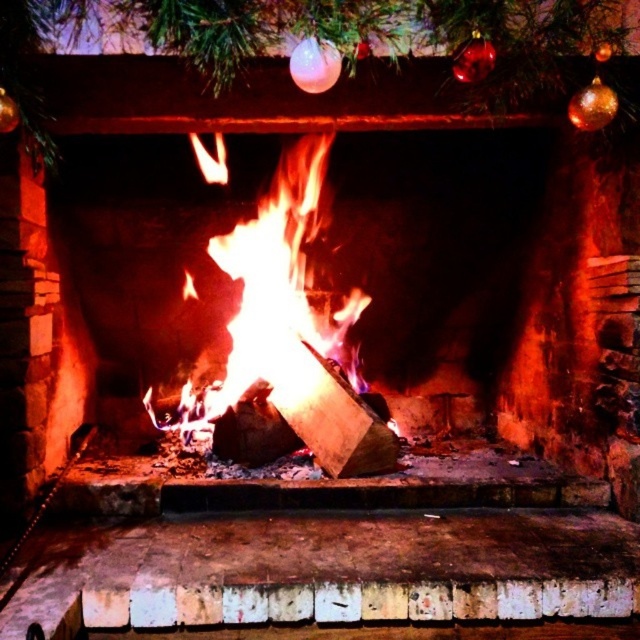
Question: Does shiny glass ornaments at upper center have a lesser width compared to flaming wood at center?

Choices:
 (A) yes
 (B) no

Answer: (B)

Question: Can you confirm if brick fireplace at center is positioned above flaming wood at center?

Choices:
 (A) no
 (B) yes

Answer: (B)

Question: Which of the following is the farthest from the observer?

Choices:
 (A) flaming wood at center
 (B) brick fireplace at center
 (C) shiny glass ornaments at upper center

Answer: (A)

Question: Which point is farther from the camera taking this photo?

Choices:
 (A) (241, 72)
 (B) (211, 276)

Answer: (B)

Question: Based on their relative distances, which object is nearer to the shiny glass ornaments at upper center?

Choices:
 (A) brick fireplace at center
 (B) flaming wood at center

Answer: (A)

Question: Does brick fireplace at center appear over shiny glass ornaments at upper center?

Choices:
 (A) no
 (B) yes

Answer: (A)